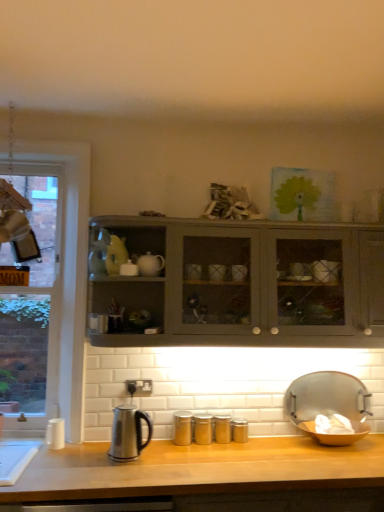
Identify the location of empty space that is ontop of wooden at center. (285, 457).